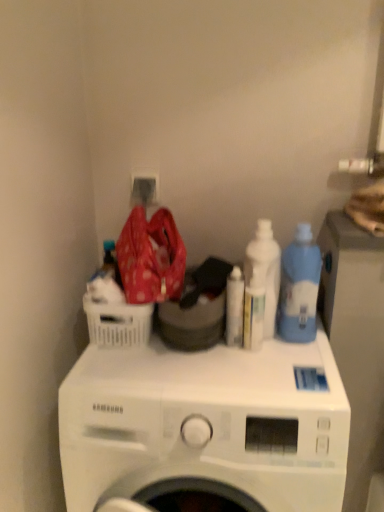
At what (x,y) coordinates should I click in order to perform the action: click on vacant area situated to the left side of white plastic bottle at center. Please return your answer as a coordinate pair (x, y). Looking at the image, I should click on (173, 364).